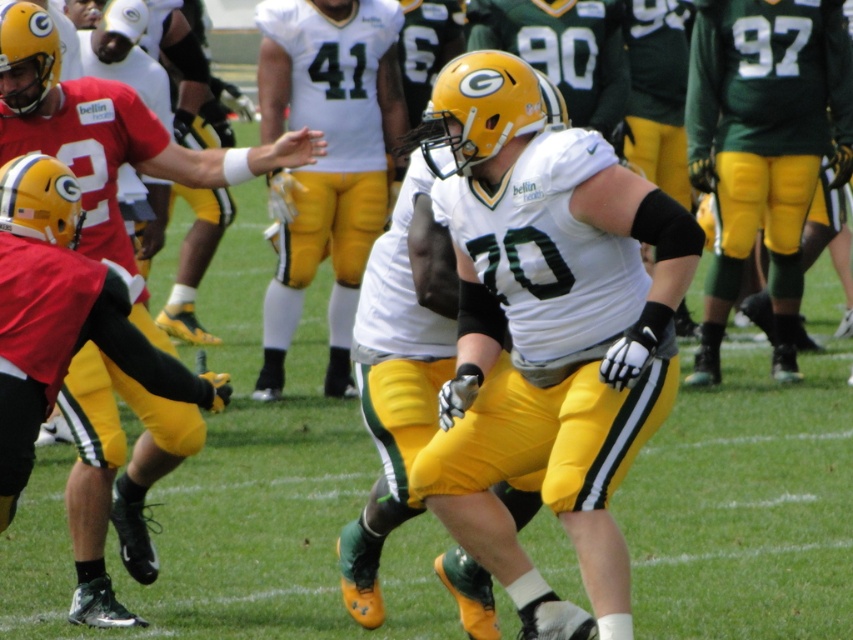
You are a sports analyst observing the football game. You notice the matte green jersey at center and the white jersey at center. Based on their positions, can you determine if they are teammates or opponents?

The matte green jersey at center and the white jersey at center are 7.09 feet away from each other, which is a typical distance for opposing players during a tackle situation. Since they are wearing different colored jerseys, they are likely opponents.

You are a photographer standing at the center of the field during the football game. You notice two points marked in the scene. Which point, point (608,225) or point (329,202), is closer to your position?

Point (608,225) is closer to the viewer than point (329,202).